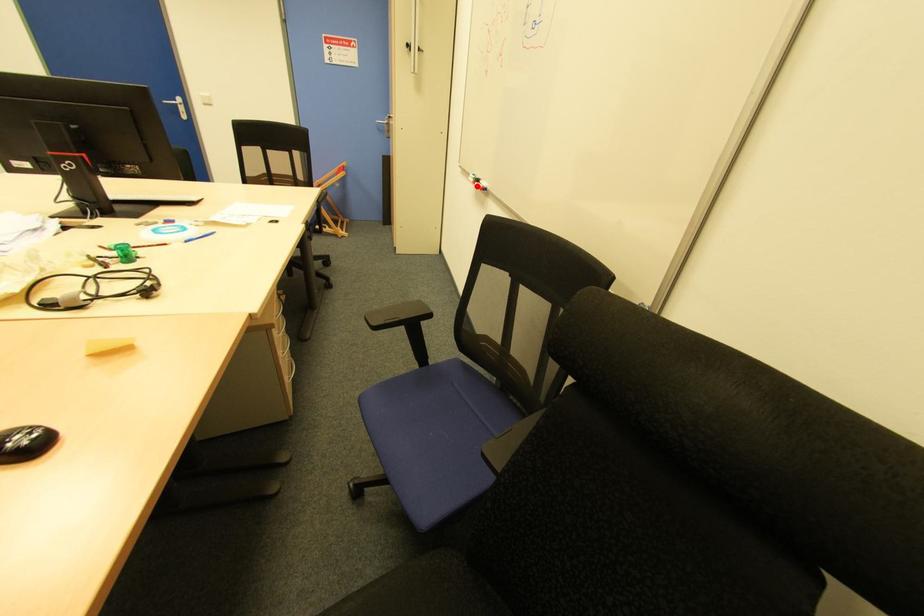
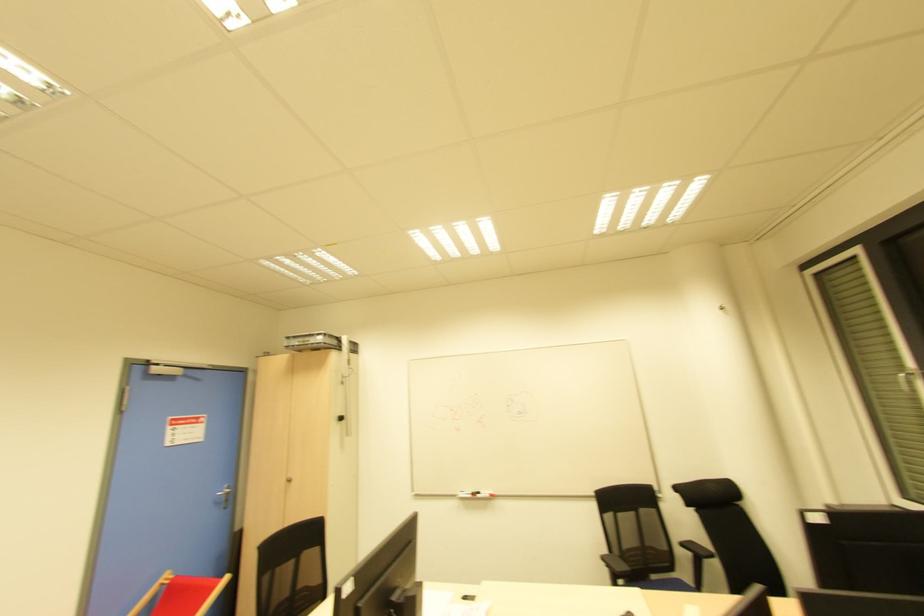
Question: I am providing you with two images of the same scene from different viewpoints. A red point is marked on the first image. At the location where the point appears in image 1, is it still visible in image 2?

Choices:
 (A) Yes
 (B) No

Answer: (A)